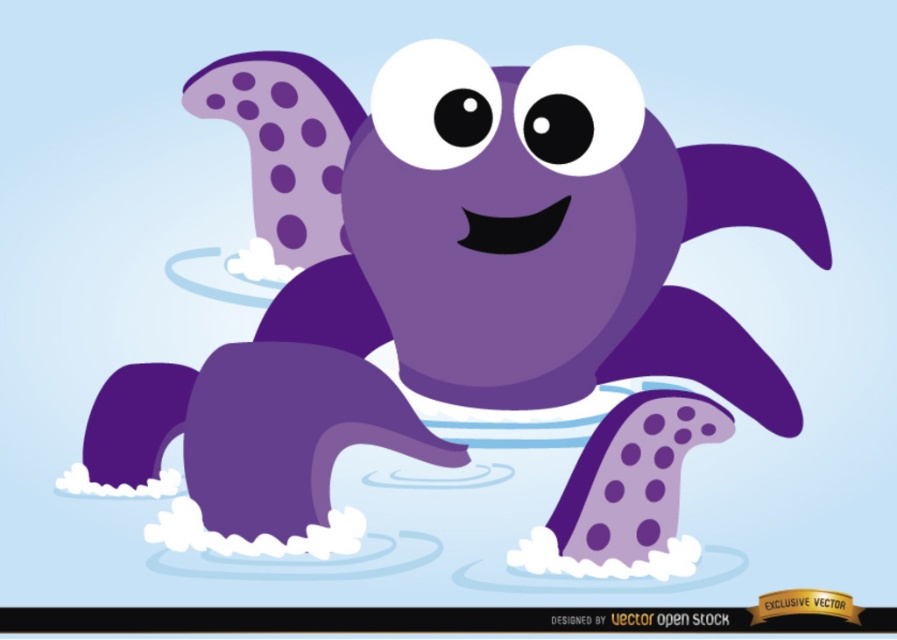
Who is positioned more to the left, matte black eye at center or matte black eye at upper center?

matte black eye at upper center is more to the left.

Who is higher up, matte black eye at center or matte black eye at upper center?

Positioned higher is matte black eye at upper center.

Between point (544, 109) and point (443, 124), which one is positioned behind?

The point (544, 109) is more distant.

At what (x,y) coordinates should I click in order to perform the action: click on matte black eye at center. Please return your answer as a coordinate pair (x, y). The height and width of the screenshot is (640, 897). Looking at the image, I should click on 556,129.

Between matte purple turtle at center and matte black eye at center, which one appears on the left side from the viewer's perspective?

matte purple turtle at center is more to the left.

Can you confirm if matte purple turtle at center is bigger than matte black eye at center?

Yes, matte purple turtle at center is bigger than matte black eye at center.

The height and width of the screenshot is (640, 897). I want to click on matte purple turtle at center, so click(441, 280).

At what (x,y) coordinates should I click in order to perform the action: click on matte purple turtle at center. Please return your answer as a coordinate pair (x, y). The height and width of the screenshot is (640, 897). Looking at the image, I should click on (441, 280).

Who is taller, matte purple turtle at center or matte black eye at upper center?

Standing taller between the two is matte purple turtle at center.

I want to click on matte purple turtle at center, so click(441, 280).